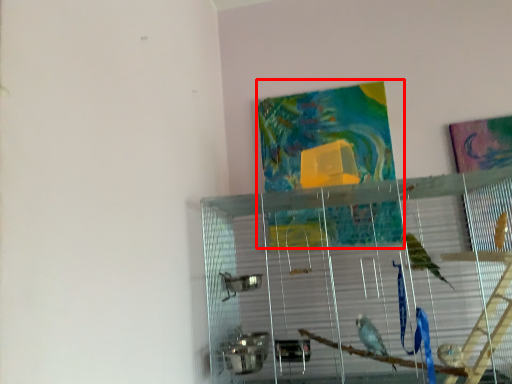
Question: Where is tapestry (annotated by the red box) located in relation to glass box in the image?

Choices:
 (A) left
 (B) right

Answer: (A)